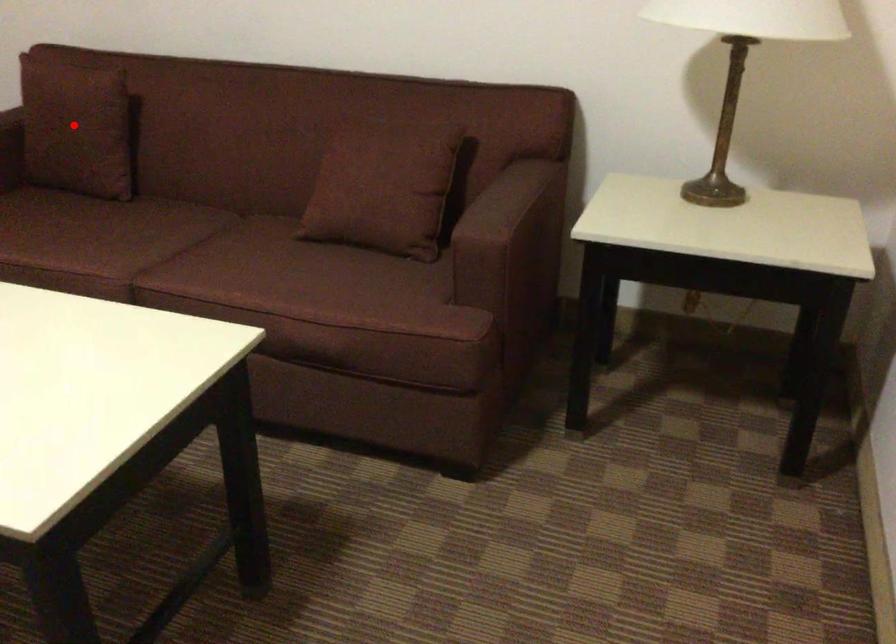
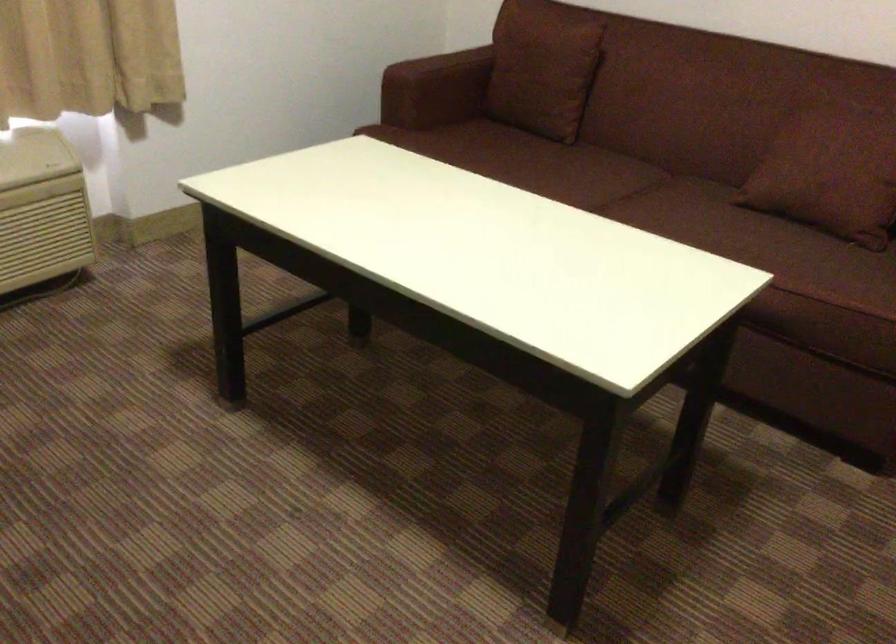
Locate, in the second image, the point that corresponds to the highlighted location in the first image.

(543, 69)